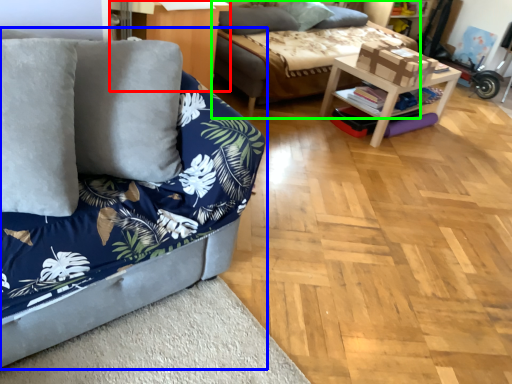
Question: Which is farther away from dresser (highlighted by a red box)? studio couch (highlighted by a blue box) or studio couch (highlighted by a green box)?

Choices:
 (A) studio couch
 (B) studio couch

Answer: (A)